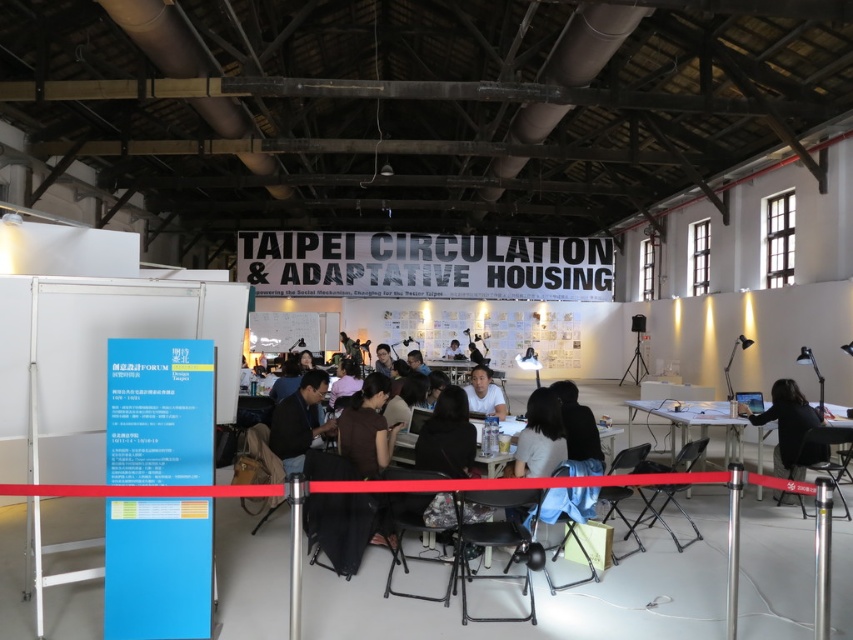
Question: Which object appears farthest from the camera in this image?

Choices:
 (A) matte white shirt at center
 (B) dark blue shirt at center
 (C) dark brown leather jacket at center

Answer: (A)

Question: Which point is farther to the camera?

Choices:
 (A) (346, 336)
 (B) (376, 362)
 (C) (415, 358)
 (D) (718, 419)

Answer: (A)

Question: Does matte black shirt at center have a larger size compared to matte white shirt at center?

Choices:
 (A) no
 (B) yes

Answer: (A)

Question: Is white plastic table at right above dark brown leather jacket at center?

Choices:
 (A) yes
 (B) no

Answer: (B)

Question: Observing the image, what is the correct spatial positioning of dark blue shirt at center in reference to dark brown leather jacket at center?

Choices:
 (A) left
 (B) right

Answer: (B)

Question: Which point appears closest to the camera in this image?

Choices:
 (A) (457, 353)
 (B) (422, 369)
 (C) (630, 442)

Answer: (C)